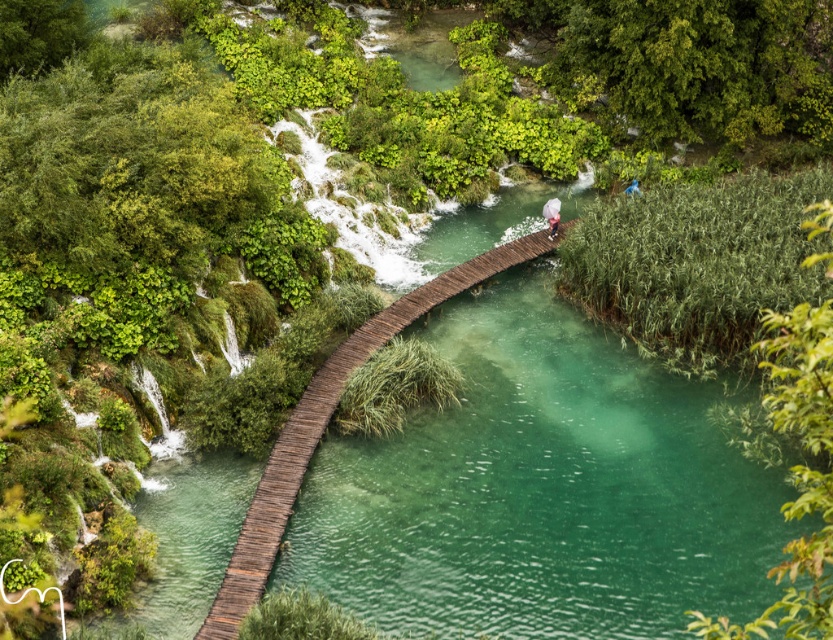
Question: Is the position of wooden bridge at center less distant than that of blue fabric person at upper center?

Choices:
 (A) yes
 (B) no

Answer: (A)

Question: Can you confirm if light pink fabric umbrella at center is positioned to the left of blue fabric person at upper center?

Choices:
 (A) yes
 (B) no

Answer: (A)

Question: Which point is closer to the camera?

Choices:
 (A) light pink fabric umbrella at center
 (B) wooden bridge at center

Answer: (B)

Question: Is wooden bridge at center bigger than blue fabric person at upper center?

Choices:
 (A) no
 (B) yes

Answer: (B)

Question: Which point appears closest to the camera in this image?

Choices:
 (A) (227, 611)
 (B) (556, 205)

Answer: (A)

Question: Which point appears closest to the camera in this image?

Choices:
 (A) (557, 198)
 (B) (288, 486)

Answer: (B)